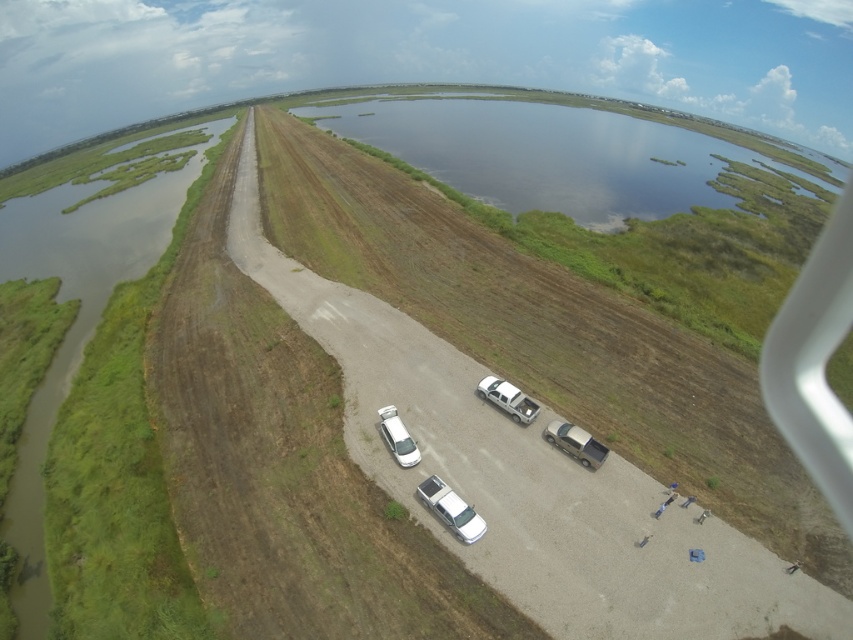
You are a drone operator tasked with capturing aerial footage of the rural area shown in the image. You need to fly your drone from the point at coordinates point at (457,525) to a destination point that is 42.21 meters away. Given the terrain described, what potential obstacles might you encounter along the flight path?

The flight path between the point at (457,525) and the destination point 42.21 meters away may encounter obstacles such as the dense vegetation on the left side of the dirt road and the water expanse on the right side, which could pose risks for the drone.

You are a drone operator flying over a rural area. You see a green grassy waterway at left and a white glossy car at center. Which object is closer to the drone from above?

The green grassy waterway at left is in front of the white glossy car at center, so it is closer to the drone from above.